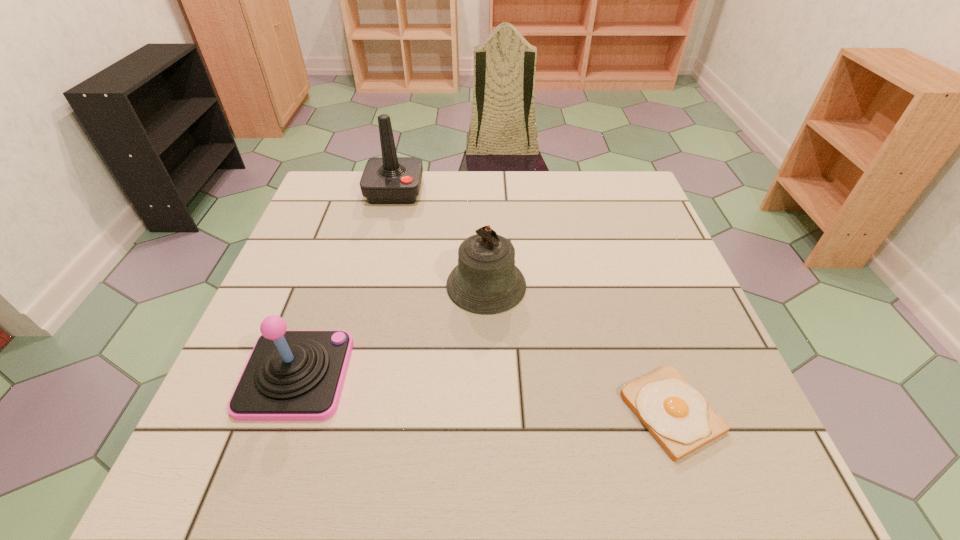
This screenshot has width=960, height=540. What are the coordinates of `unoccupied area between the tallest object and the nearer joystick` in the screenshot? It's located at (346, 283).

Find the location of a particular element. free spot between the shortest object and the shorter joystick is located at coordinates (484, 394).

What are the coordinates of `free space between the nearer joystick and the toast` in the screenshot? It's located at (484, 394).

Select which object is the closest to the nearer joystick. Please provide its 2D coordinates. Your answer should be formatted as a tuple, i.e. [(x, y)], where the tuple contains the x and y coordinates of a point satisfying the conditions above.

[(486, 281)]

Image resolution: width=960 pixels, height=540 pixels. In order to click on the closest object to the rightmost object in this screenshot , I will do `click(486, 281)`.

Find the location of a particular element. This screenshot has width=960, height=540. vacant space that satisfies the following two spatial constraints: 1. forward from the base of the toast; 2. on the left side of the nearer joystick is located at coordinates (283, 412).

At what (x,y) coordinates should I click in order to perform the action: click on blank area in the image that satisfies the following two spatial constraints: 1. on the front side of the tallest object; 2. on the left side of the bell. Please return your answer as a coordinate pair (x, y). Looking at the image, I should click on (372, 285).

Image resolution: width=960 pixels, height=540 pixels. I want to click on free space that satisfies the following two spatial constraints: 1. forward from the base of the rightmost object; 2. on the right side of the nearer joystick, so click(283, 412).

Locate an element on the screen. This screenshot has width=960, height=540. vacant position in the image that satisfies the following two spatial constraints: 1. forward from the base of the shorter joystick; 2. on the back side of the toast is located at coordinates (283, 412).

Where is `blank space that satisfies the following two spatial constraints: 1. forward from the base of the toast; 2. on the left side of the nearer joystick`? blank space that satisfies the following two spatial constraints: 1. forward from the base of the toast; 2. on the left side of the nearer joystick is located at coordinates (283, 412).